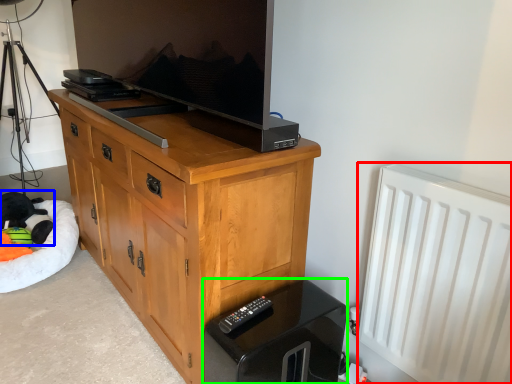
Question: Based on their relative distances, which object is nearer to radiator (highlighted by a red box)? Choose from animal (highlighted by a blue box) and vanity (highlighted by a green box).

Choices:
 (A) animal
 (B) vanity

Answer: (B)